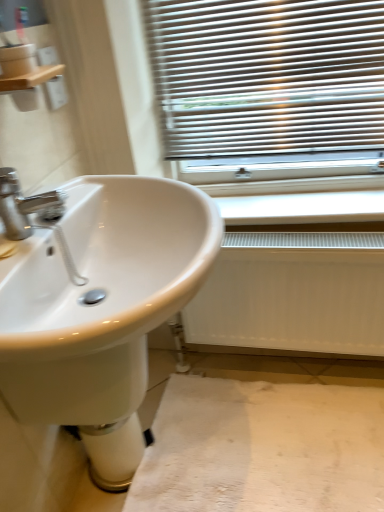
Question: Based on their sizes in the image, would you say wooden shelf at upper left is bigger or smaller than white plastic radiator at lower center?

Choices:
 (A) big
 (B) small

Answer: (B)

Question: In the image, is wooden shelf at upper left positioned in front of or behind white plastic radiator at lower center?

Choices:
 (A) front
 (B) behind

Answer: (A)

Question: Based on their relative distances, which object is nearer to the white glossy bidet at lower center?

Choices:
 (A) white plastic radiator at lower center
 (B) white matte radiator at lower right
 (C) white glossy sink at left
 (D) wooden shelf at upper left
 (E) white fabric at lower center

Answer: (C)

Question: Which is farther from the wooden shelf at upper left?

Choices:
 (A) white fabric at lower center
 (B) white glossy sink at left
 (C) white glossy bidet at lower center
 (D) white matte radiator at lower right
 (E) white plastic radiator at lower center

Answer: (A)